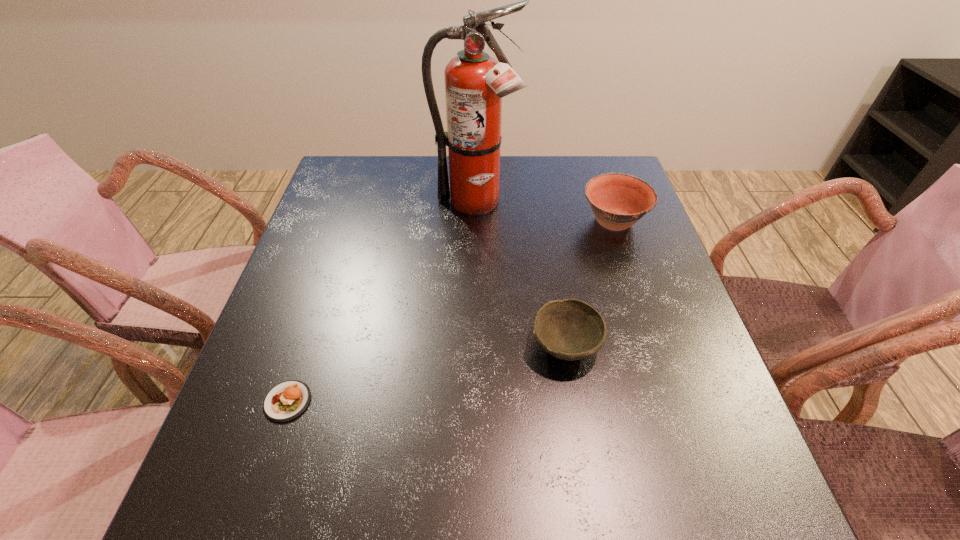
Identify the location of unoccupied area between the shortest object and the second object from left to right. (381, 303).

This screenshot has width=960, height=540. In order to click on unoccupied position between the second nearest object and the rightmost object in this screenshot , I will do `click(589, 284)`.

At what (x,y) coordinates should I click in order to perform the action: click on vacant area between the nearest object and the fire extinguisher. Please return your answer as a coordinate pair (x, y). Looking at the image, I should click on (381, 303).

Identify which object is the second nearest to the patty (food). Please provide its 2D coordinates. Your answer should be formatted as a tuple, i.e. [(x, y)], where the tuple contains the x and y coordinates of a point satisfying the conditions above.

[(475, 82)]

Where is `the second closest object to the farther bowl`? the second closest object to the farther bowl is located at coordinates (570, 329).

Identify the location of vacant area in the image that satisfies the following two spatial constraints: 1. on the back side of the nearest object; 2. on the left side of the farther bowl. Image resolution: width=960 pixels, height=540 pixels. (347, 222).

Locate an element on the screen. Image resolution: width=960 pixels, height=540 pixels. vacant point that satisfies the following two spatial constraints: 1. from the nozzle of the third object from left to right; 2. on the left side of the second object from left to right is located at coordinates (472, 346).

The image size is (960, 540). I want to click on vacant space that satisfies the following two spatial constraints: 1. on the back side of the patty (food); 2. on the left side of the second tallest object, so click(347, 222).

Find the location of a particular element. Image resolution: width=960 pixels, height=540 pixels. free space that satisfies the following two spatial constraints: 1. from the nozzle of the fire extinguisher; 2. on the left side of the taller bowl is located at coordinates (474, 222).